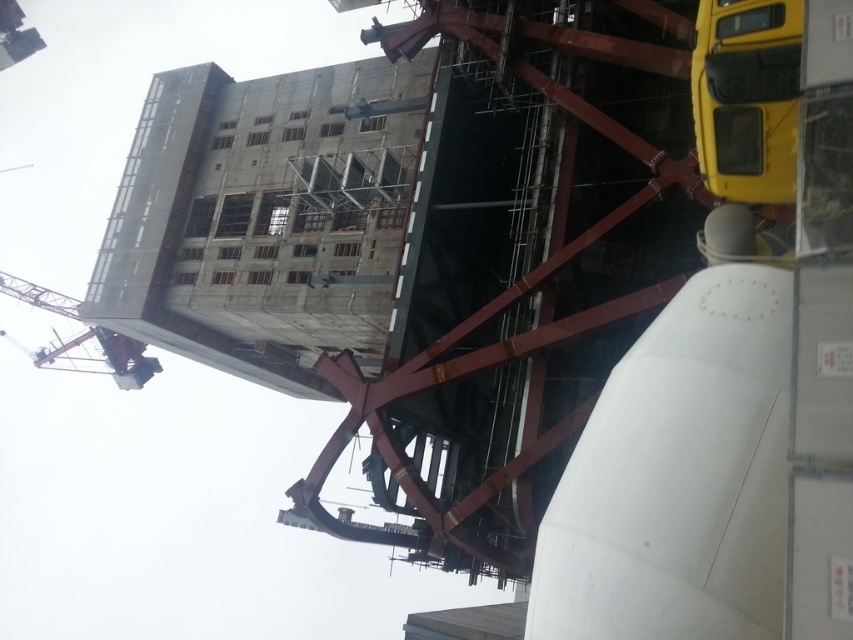
Question: Can you confirm if yellow matte truck at upper right is positioned below metallic red crane at upper left?

Choices:
 (A) yes
 (B) no

Answer: (B)

Question: Can you confirm if yellow matte truck at upper right is thinner than metallic red crane at upper left?

Choices:
 (A) no
 (B) yes

Answer: (B)

Question: Can you confirm if yellow matte truck at upper right is positioned to the right of metallic red crane at upper left?

Choices:
 (A) yes
 (B) no

Answer: (A)

Question: Which object appears closest to the camera in this image?

Choices:
 (A) metallic red crane at upper left
 (B) yellow matte truck at upper right

Answer: (B)

Question: Among these objects, which one is nearest to the camera?

Choices:
 (A) metallic red crane at upper left
 (B) yellow matte truck at upper right

Answer: (B)